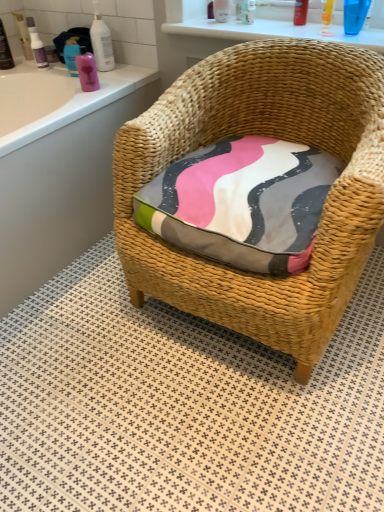
This screenshot has height=512, width=384. In order to click on free space to the left of translucent plastic bottle at upper center, the 3th toiletry viewed from the right in this screenshot , I will do `click(211, 24)`.